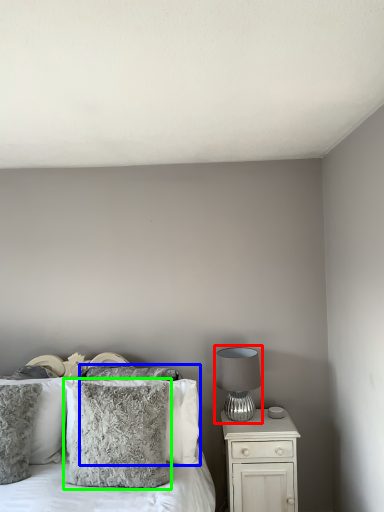
Question: Which object is positioned farthest from table lamp (highlighted by a red box)? Select from pillow (highlighted by a blue box) and pillow (highlighted by a green box).

Choices:
 (A) pillow
 (B) pillow

Answer: (B)